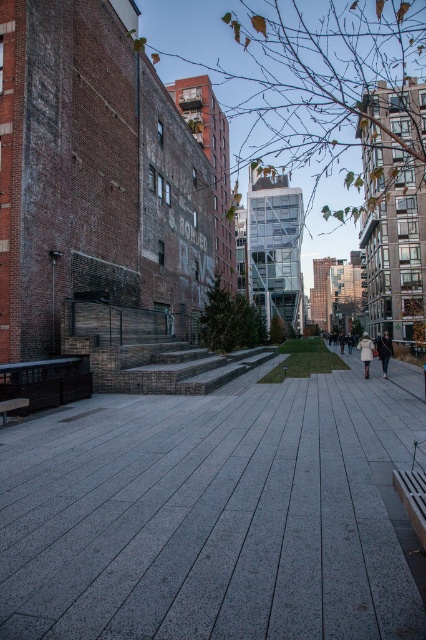
Question: Is the position of gray concrete pavement at center more distant than that of white wool coat at right?

Choices:
 (A) yes
 (B) no

Answer: (B)

Question: Which object appears farthest from the camera in this image?

Choices:
 (A) gray concrete pavement at center
 (B) wooden park bench at lower right

Answer: (B)

Question: Based on their relative distances, which object is nearer to the gray concrete pavement at center?

Choices:
 (A) dark brown leather jacket at center
 (B) white wool coat at right
 (C) wooden park bench at lower right

Answer: (C)

Question: In this image, where is gray concrete pavement at center located relative to wooden park bench at lower right?

Choices:
 (A) right
 (B) left

Answer: (B)

Question: Which of the following is the closest to the observer?

Choices:
 (A) tap(406, 529)
 (B) tap(382, 349)
 (C) tap(406, 492)

Answer: (C)

Question: Observing the image, what is the correct spatial positioning of gray concrete pavement at center in reference to white wool coat at right?

Choices:
 (A) above
 (B) below

Answer: (A)